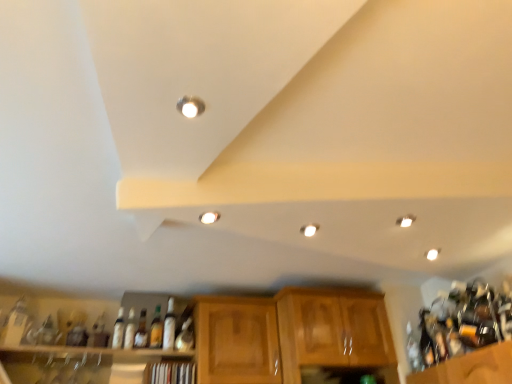
Question: From a real-world perspective, is matte glass bottle at center, the 6th bottle in the left-to-right sequence, positioned above or below clear glass bottle at right, the first bottle positioned from the right?

Choices:
 (A) above
 (B) below

Answer: (A)

Question: Is matte glass bottle at center, placed as the 3th bottle when sorted from right to left, taller or shorter than clear glass bottle at right, the first bottle positioned from the right?

Choices:
 (A) short
 (B) tall

Answer: (B)

Question: Which of these objects is positioned farthest from the clear glass bottle at right, which appears as the eighth bottle when viewed from the left?

Choices:
 (A) wooden cabinet at center, acting as the 2th cabinetry starting from the left
 (B) translucent glass bottle at center, arranged as the third bottle when viewed from the left
 (C) white glossy bottle at center, which is counted as the fourth bottle, starting from the left
 (D) matte glass bottle at center, marked as the 4th bottle in a right-to-left arrangement
 (E) wooden shelf at lower center, the second shelf in the left-to-right sequence

Answer: (B)

Question: Estimate the real-world distances between objects in this image. Which object is closer to the matte silver light fixture at upper center, which is counted as the first lighting, starting from the front?

Choices:
 (A) wooden cabinet at center, which is the 1th cabinetry from left to right
 (B) white glossy light fixture at upper right, placed as the third lighting when sorted from top to bottom
 (C) matte glass bottle at center, the 6th bottle in the left-to-right sequence
 (D) matte glass bottle at lower left, marked as the 1th bottle in a left-to-right arrangement
 (E) white glossy bottle at center, which is counted as the fourth bottle, starting from the left

Answer: (B)